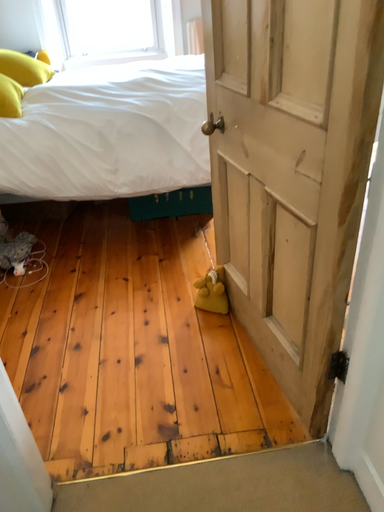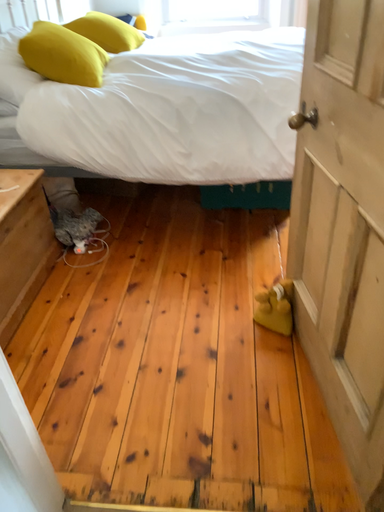
Question: Which way did the camera rotate in the video?

Choices:
 (A) rotated left
 (B) rotated right

Answer: (A)